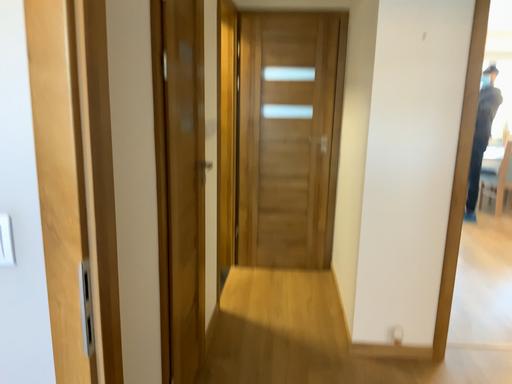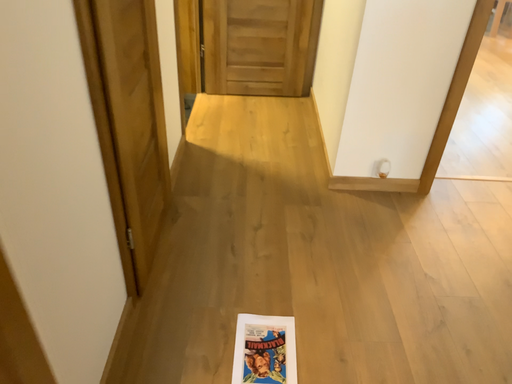
Question: How did the camera likely rotate when shooting the video?

Choices:
 (A) rotated upward
 (B) rotated downward

Answer: (B)